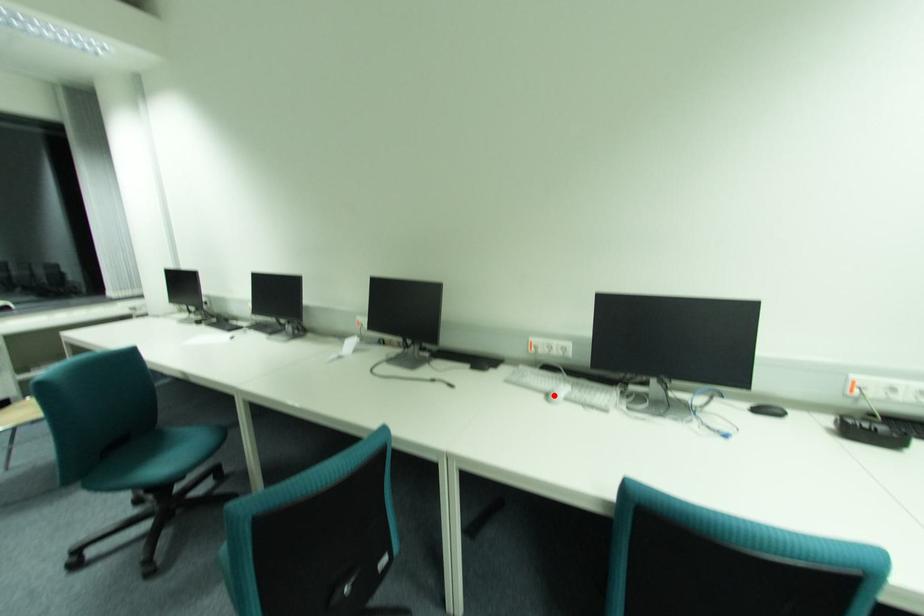
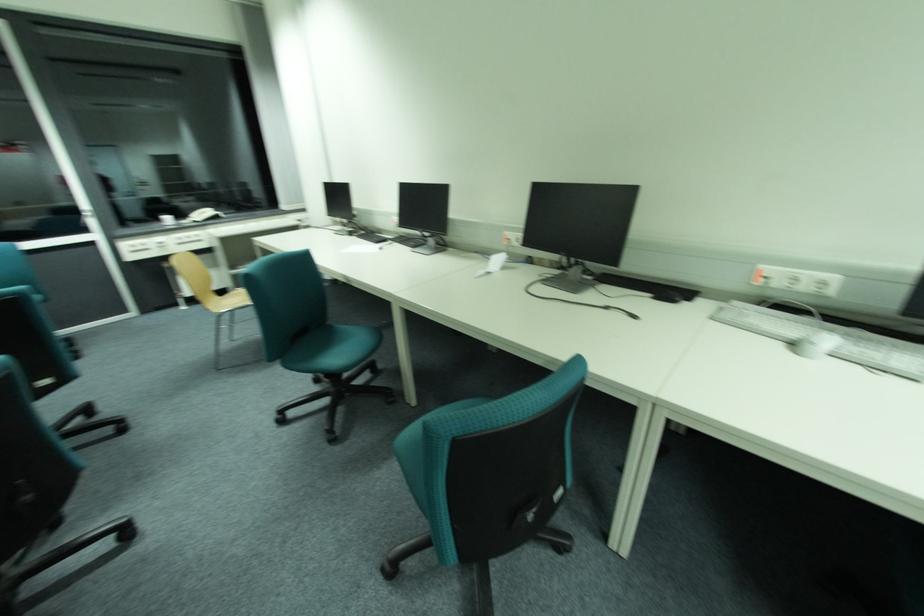
In the second image, find the point that corresponds to the highlighted location in the first image.

(800, 345)